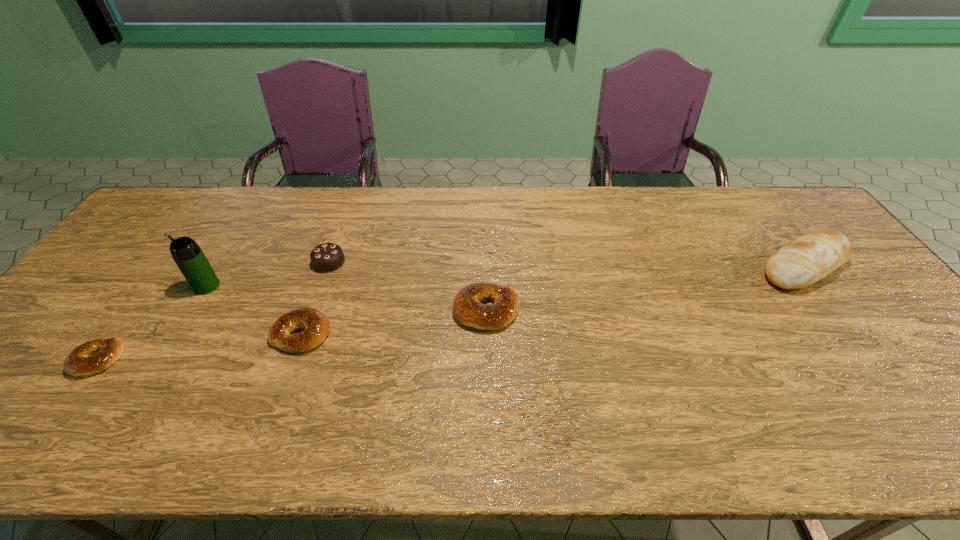
Identify the location of object that is at the left edge. (95, 356).

This screenshot has width=960, height=540. In order to click on object situated at the right edge in this screenshot , I will do `click(809, 258)`.

I want to click on object situated at the near left corner, so click(95, 356).

You are a GUI agent. You are given a task and a screenshot of the screen. Output one action in this format:
    pyautogui.click(x=<x>, y=<y>)
    Task: Click on the free space at the far edge of the desktop
    The image size is (960, 540).
    Given the screenshot: What is the action you would take?
    pyautogui.click(x=732, y=188)

The height and width of the screenshot is (540, 960). I want to click on free space at the near edge of the desktop, so click(889, 402).

In the image, there is a desktop. What are the coordinates of `blank space at the far left corner` in the screenshot? It's located at (192, 217).

Locate an element on the screen. The image size is (960, 540). blank region between the second bagel from right to left and the tallest object is located at coordinates (254, 310).

Find the location of `free area in between the chocolate cake and the shortest bagel`. free area in between the chocolate cake and the shortest bagel is located at coordinates (213, 310).

Locate an element on the screen. This screenshot has width=960, height=540. free space between the fifth shortest object and the leftmost object is located at coordinates (451, 313).

You are a GUI agent. You are given a task and a screenshot of the screen. Output one action in this format:
    pyautogui.click(x=<x>, y=<y>)
    Task: Click on the free space between the thermos bottle and the shortest object
    This screenshot has width=960, height=540.
    Given the screenshot: What is the action you would take?
    pyautogui.click(x=153, y=322)